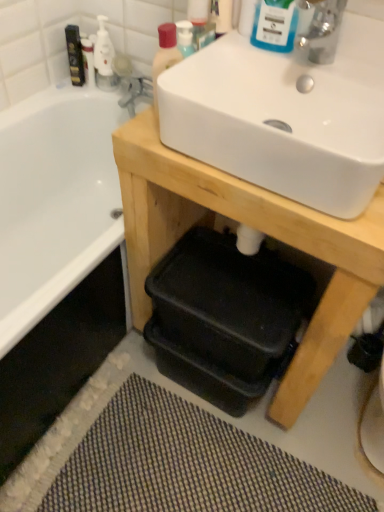
Locate an element on the screen. free region under textured gray bath mat at lower center (from a real-world perspective) is located at coordinates coord(189,461).